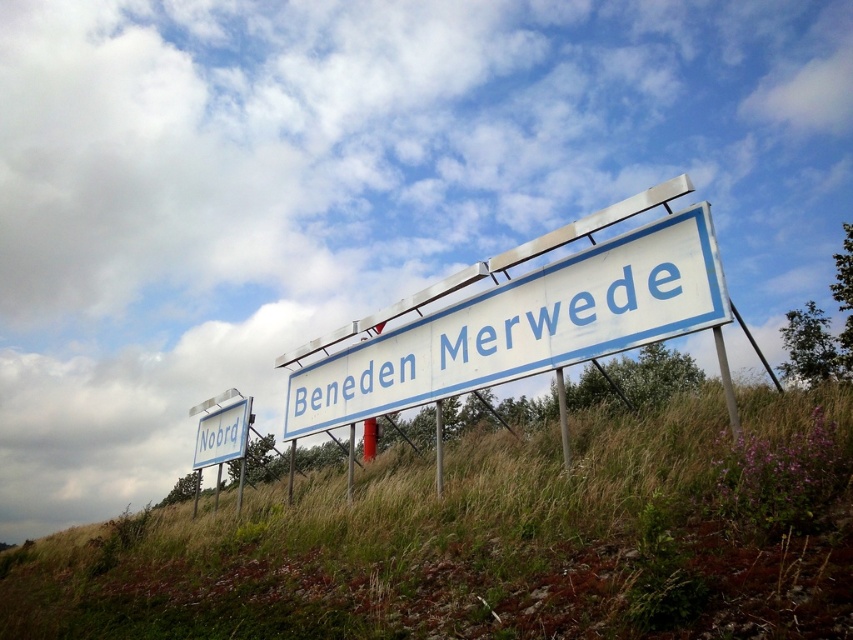
You are standing in front of two road signs. You notice two points marked on the image. One is at coordinate point (663, 308) and the other at point (233, 420). Which point is closer to you?

Point (663, 308) is closer to the viewer than point (233, 420).